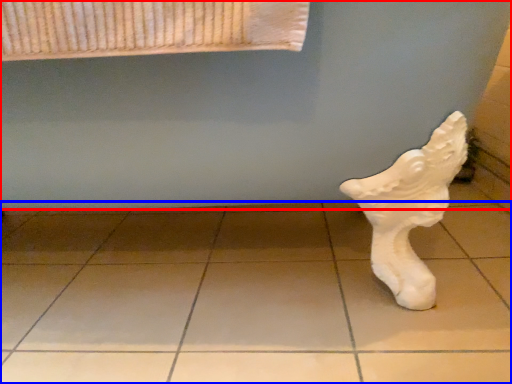
Question: Which of the following is the farthest to the observer, bath (highlighted by a red box) or tile (highlighted by a blue box)?

Choices:
 (A) bath
 (B) tile

Answer: (B)